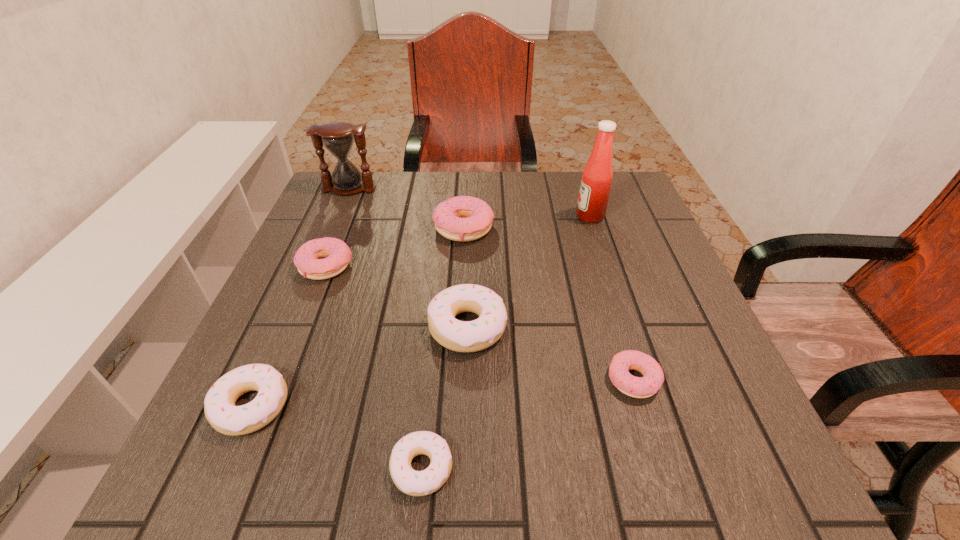
At what (x,y) coordinates should I click in order to perform the action: click on the nearest pink doughnut. Please return your answer as a coordinate pair (x, y). Looking at the image, I should click on (653, 377).

The image size is (960, 540). Identify the location of the smallest pink doughnut. (653, 377).

The image size is (960, 540). In order to click on the smallest white doughnut in this screenshot , I will do (x=415, y=483).

The image size is (960, 540). Identify the location of vacant space located 0.110m on the front-facing side of the tallest object. (533, 217).

Find the location of `vacant area situated on the front-facing side of the tallest object`. vacant area situated on the front-facing side of the tallest object is located at coordinates (481, 217).

The width and height of the screenshot is (960, 540). Find the location of `vacant space situated on the front-facing side of the tallest object`. vacant space situated on the front-facing side of the tallest object is located at coordinates (449, 217).

Image resolution: width=960 pixels, height=540 pixels. I want to click on vacant space located 0.250m on the front of the farthest object, so click(321, 255).

Where is `blank space located on the right of the biggest pink doughnut`? blank space located on the right of the biggest pink doughnut is located at coordinates (564, 228).

You are a GUI agent. You are given a task and a screenshot of the screen. Output one action in this format:
    pyautogui.click(x=<x>, y=<y>)
    Task: Click on the vacant space located on the front of the biggest white doughnut
    Image resolution: width=960 pixels, height=540 pixels.
    Given the screenshot: What is the action you would take?
    pyautogui.click(x=465, y=451)

Image resolution: width=960 pixels, height=540 pixels. I want to click on free region located 0.060m on the back of the second biggest pink doughnut, so click(338, 234).